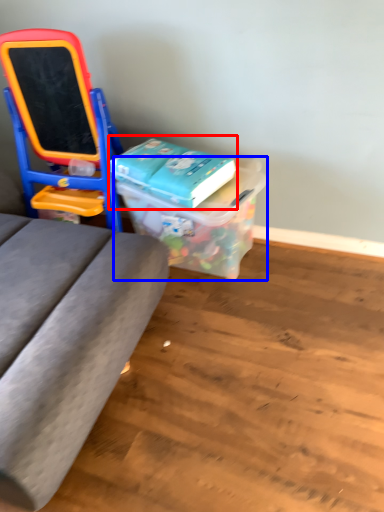
Question: Which point is closer to the camera, book (highlighted by a red box) or box (highlighted by a blue box)?

Choices:
 (A) book
 (B) box

Answer: (B)